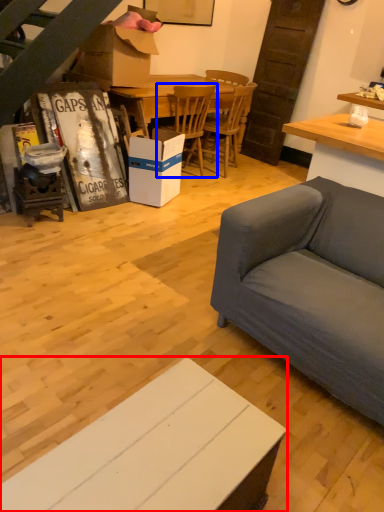
Question: Which point is further to the camera, cabinetry (highlighted by a red box) or chair (highlighted by a blue box)?

Choices:
 (A) cabinetry
 (B) chair

Answer: (B)